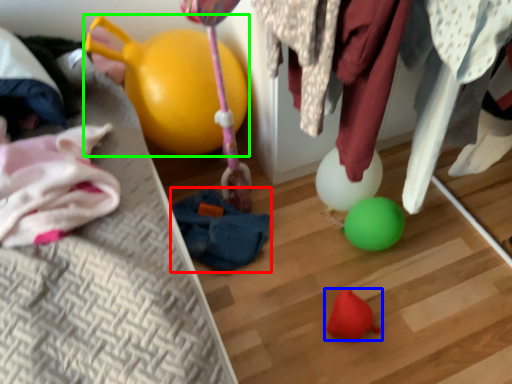
Question: Based on their relative distances, which object is farther from bean bag chair (highlighted by a red box)? Choose from toy (highlighted by a blue box) and balloon (highlighted by a green box).

Choices:
 (A) toy
 (B) balloon

Answer: (A)